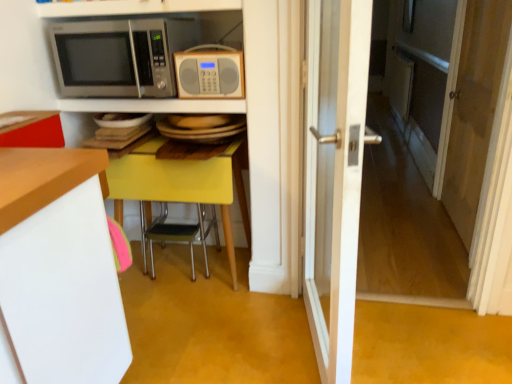
The image size is (512, 384). Identify the location of vacant region to the left of white wooden door at center. (217, 358).